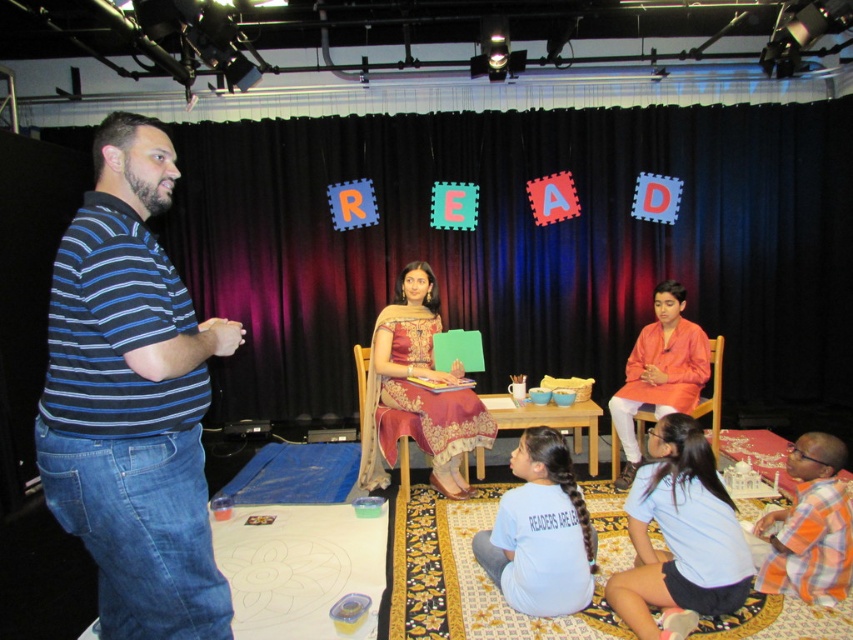
You are organizing a photo shoot for a fashion magazine and need to arrange the embroidered silk sari at center and the light blue cotton shirt at lower center in a way that highlights their unique features. Considering their sizes, which item should be placed in a position where its larger size can be better emphasized?

The embroidered silk sari at center should be placed in a position where its larger size can be better emphasized since it is wider than the light blue cotton shirt at lower center.

You are a stagehand standing at the edge of the stage. You need to hand a microphone to the man in the blue striped polo shirt at left. If your arm can reach 1.5 meters, can you reach him?

The distance between blue striped polo shirt at left and viewer is 1.47 meters, so yes, the stagehand can reach him with an arm reach of 1.5 meters.